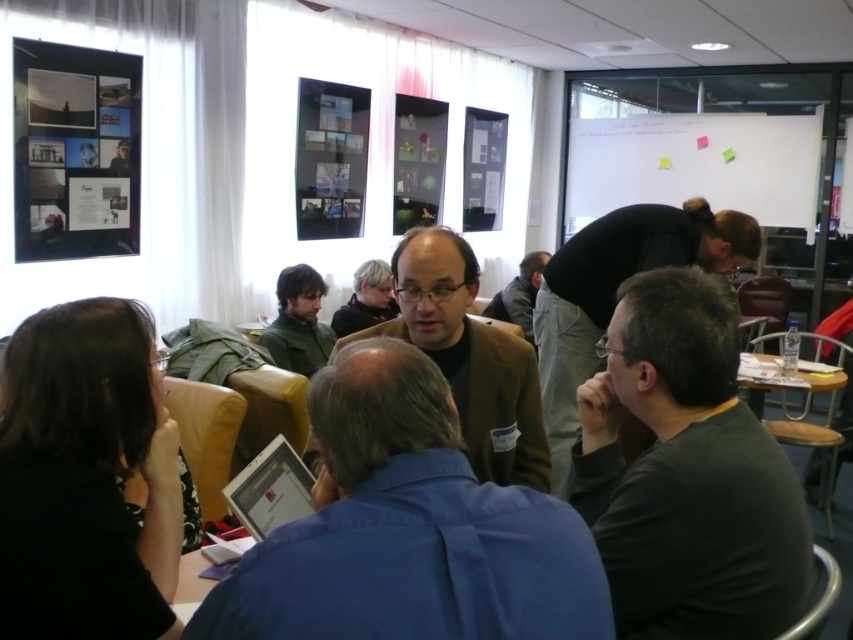
You are organizing a small event and need to place a 1.2 meter tall decoration on the wooden table at lower right. Considering the dark gray sweater at center, will the decoration fit on the table without being obstructed by the sweater?

The dark gray sweater at center is shorter than the wooden table at lower right, so the 1.2 meter tall decoration can be placed on the wooden table at lower right as it is taller than the sweater and won

You are organizing a photo shoot and need to ensure that all clothing items in the scene are visible. Given that the dark gray sweater at center and the green fabric jacket at center are both central to the composition, which clothing item might require more space in the frame to be fully captured?

The dark gray sweater at center is larger in size than the green fabric jacket at center, so it would require more space in the frame to be fully captured.